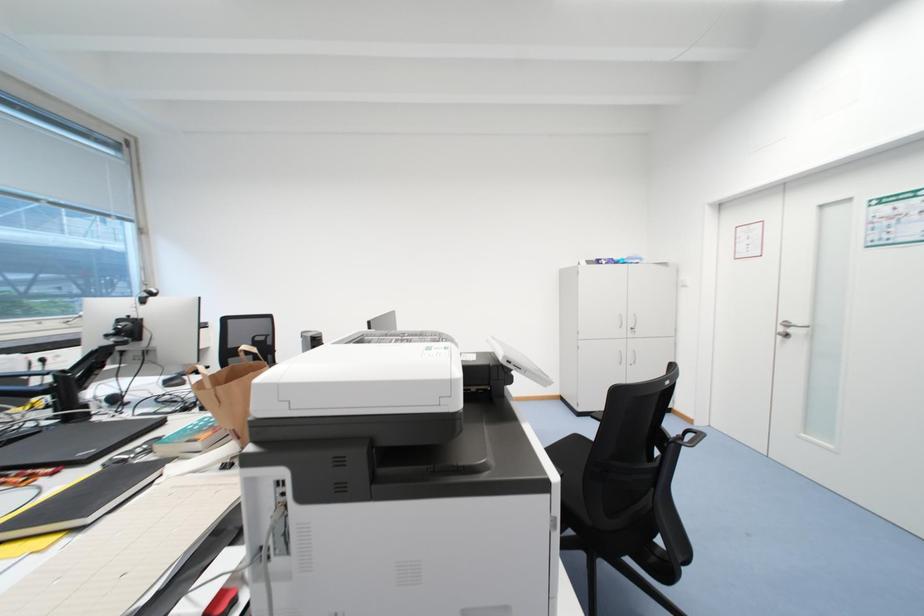
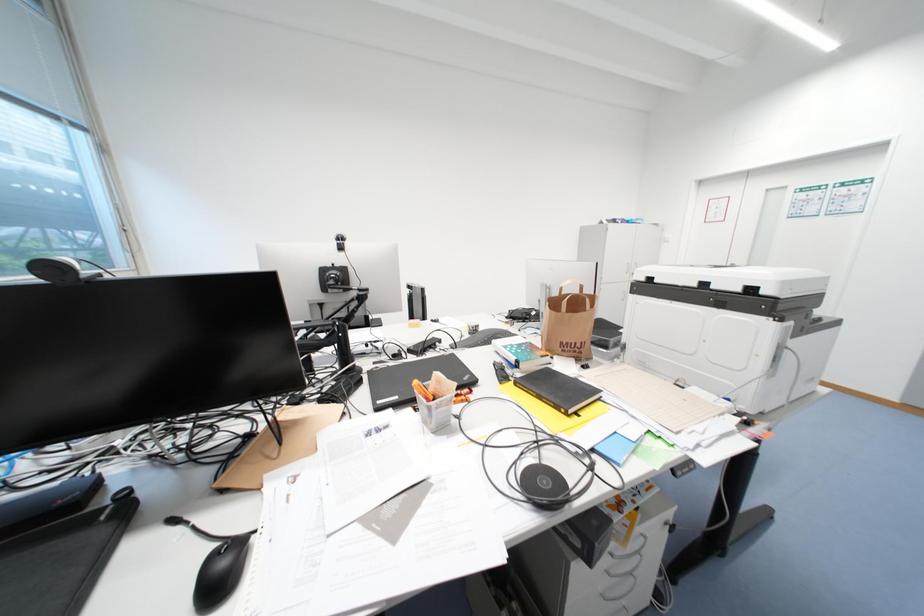
Question: In a continuous first-person perspective shot, in which direction is the camera moving?

Choices:
 (A) Left
 (B) Right
 (C) Forward
 (D) Backward

Answer: (A)